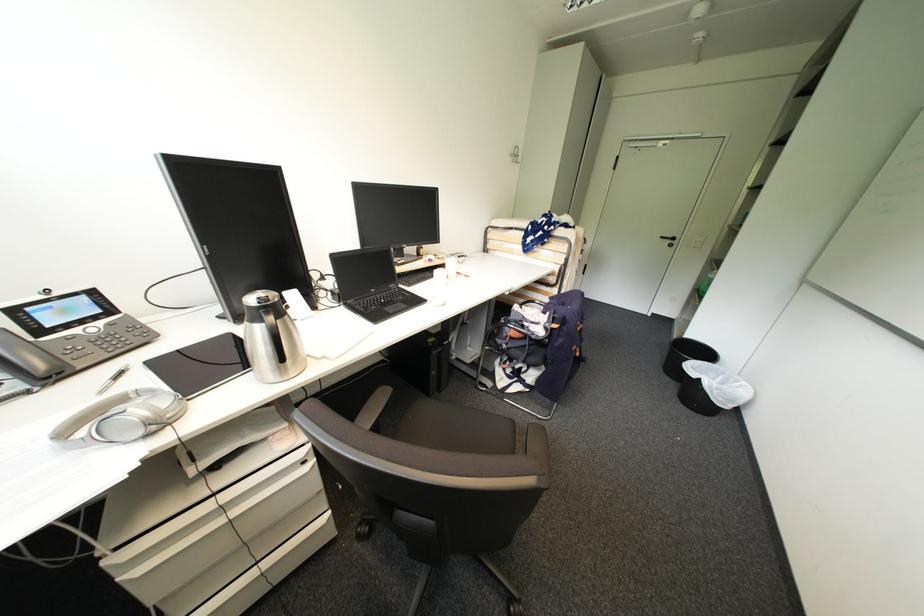
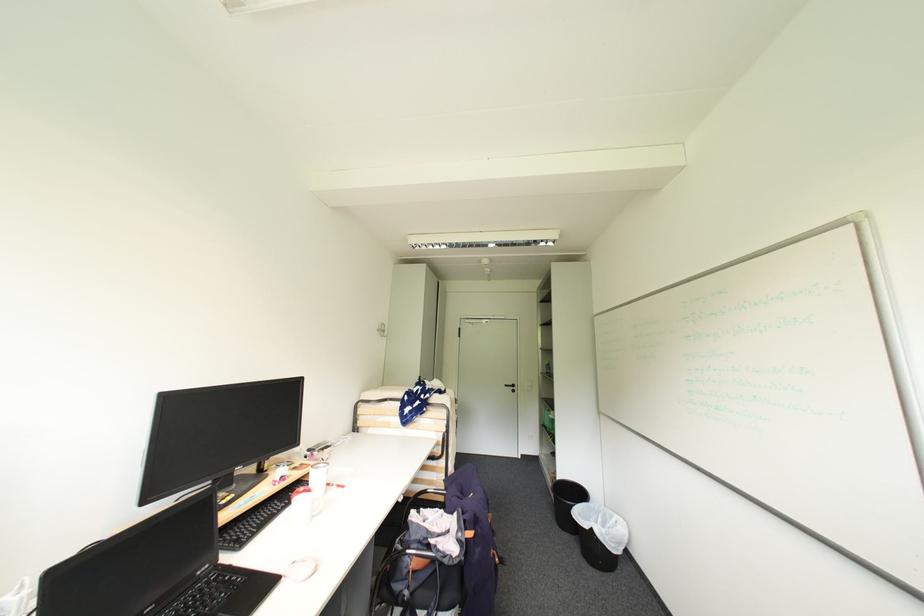
Find the pixel in the second image that matches [714,363] in the first image.

(591, 505)